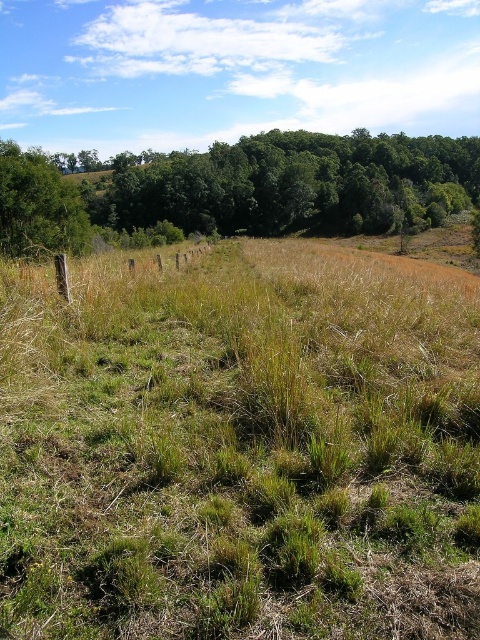
Can you confirm if green leafy tree at upper center is positioned below green leafy tree at left?

No.

Locate an element on the screen. This screenshot has height=640, width=480. green leafy tree at upper center is located at coordinates (245, 188).

Is point (241, 161) positioned behind point (7, 161)?

Yes, it is behind point (7, 161).

Find the location of a particular element. green leafy tree at upper center is located at coordinates (245, 188).